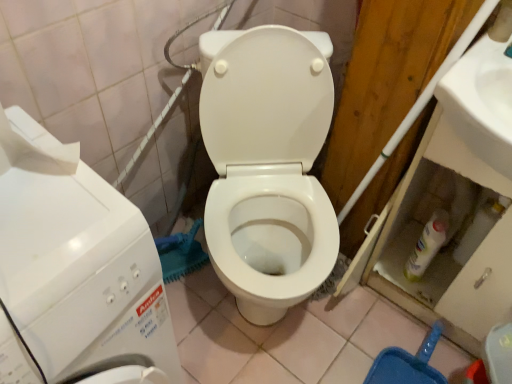
Question: Is white glossy toilet at center in front of or behind white glossy sink at upper right in the image?

Choices:
 (A) front
 (B) behind

Answer: (A)

Question: Does point (260, 261) appear closer or farther from the camera than point (500, 92)?

Choices:
 (A) farther
 (B) closer

Answer: (A)

Question: Considering the real-world distances, which object is farthest from the white glossy toilet at center?

Choices:
 (A) white glossy sink at upper right
 (B) white glossy washing machine at left

Answer: (B)

Question: Considering the real-world distances, which object is farthest from the white glossy sink at upper right?

Choices:
 (A) white glossy toilet at center
 (B) white glossy washing machine at left

Answer: (B)